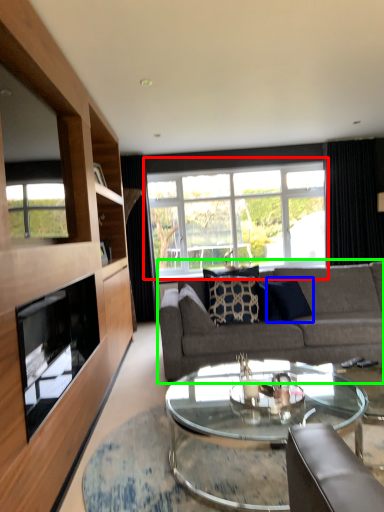
Question: Considering the real-world distances, which object is closest to window (highlighted by a red box)? pillow (highlighted by a blue box) or studio couch (highlighted by a green box).

Choices:
 (A) pillow
 (B) studio couch

Answer: (A)